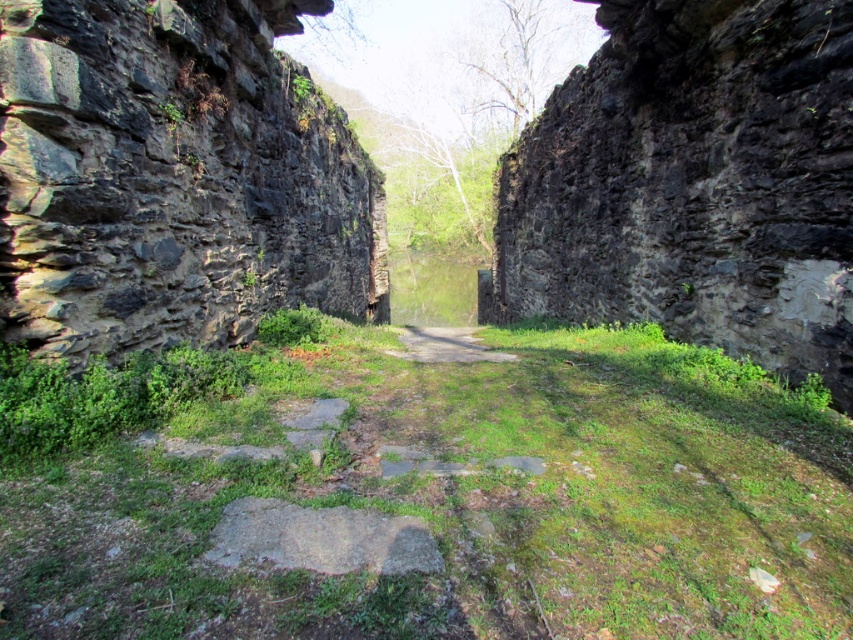
You are a hiker navigating through the narrow passageway. You need to determine if you can safely walk along the dirt path at center without hitting your head on the rough stone wall at right. Your height is 1.7 meters. Can you do it?

The rough stone wall at right is much taller than the dirt path at center. Since the wall is taller, it means the path is shorter in height, but since the path is on the ground, the height of the wall doesn

You are standing in the narrow passageway between the ancient stone walls. You see two points marked in the image. Which point is closer to you, point [206,552] or point [416,332]?

Point [206,552] is closer to the viewer than point [416,332].

You are standing in the narrow passageway between two ancient stone walls. You notice a dark gray rough stone marked by point (173, 177). Based on the scene, can you determine the position of this stone relative to the center of the passageway?

The dark gray rough stone at left is represented by point (173, 177). Since the point is at the left side of the passageway, the stone is positioned to the left of the center.